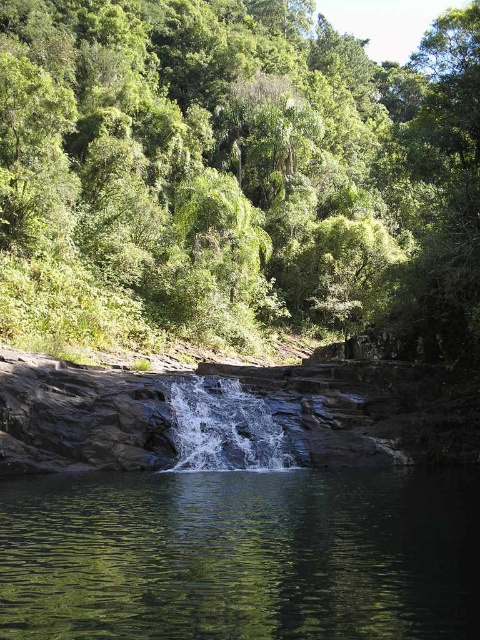
Is green leafy tree at upper center positioned before white frothy water at center?

No.

What do you see at coordinates (233, 173) in the screenshot?
I see `green leafy tree at upper center` at bounding box center [233, 173].

Where is `green leafy tree at upper center`? This screenshot has height=640, width=480. green leafy tree at upper center is located at coordinates (233, 173).

Does green reflective water at center have a lesser height compared to white frothy water at center?

Incorrect, green reflective water at center's height does not fall short of white frothy water at center's.

Who is positioned more to the right, green reflective water at center or white frothy water at center?

green reflective water at center

Is point (349, 570) farther from viewer compared to point (256, 456)?

No, (349, 570) is in front of (256, 456).

Identify the location of green reflective water at center. The image size is (480, 640). [241, 556].

Is green leafy tree at upper center bigger than green reflective water at center?

Correct, green leafy tree at upper center is larger in size than green reflective water at center.

Who is lower down, green leafy tree at upper center or green reflective water at center?

green reflective water at center is below.

Is point (164, 17) in front of point (264, 513)?

No, it is behind (264, 513).

You are a GUI agent. You are given a task and a screenshot of the screen. Output one action in this format:
    pyautogui.click(x=<x>, y=<y>)
    Task: Click on the green leafy tree at upper center
    The height and width of the screenshot is (640, 480).
    Given the screenshot: What is the action you would take?
    pos(233,173)